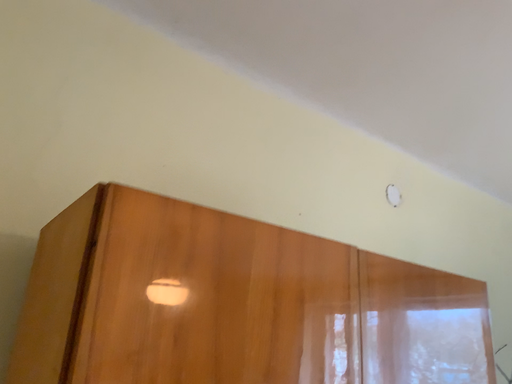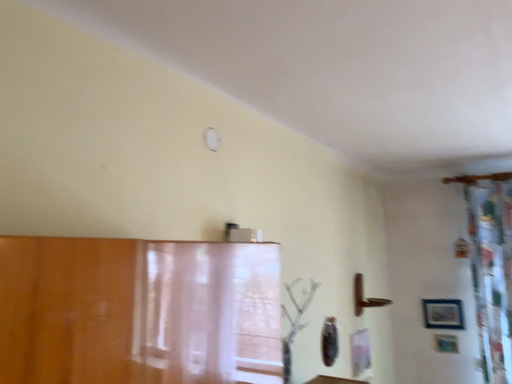
Question: How did the camera likely rotate when shooting the video?

Choices:
 (A) rotated left
 (B) rotated right

Answer: (B)